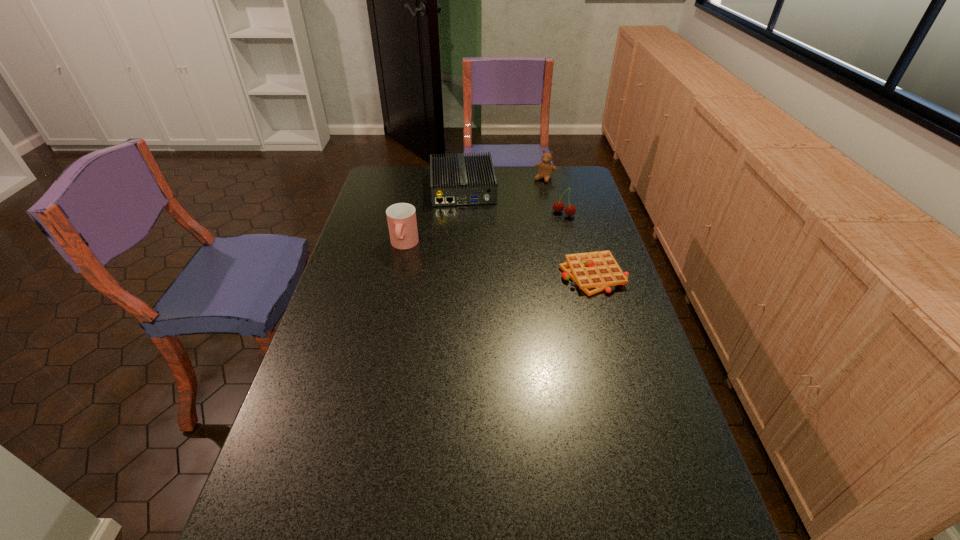
You are a GUI agent. You are given a task and a screenshot of the screen. Output one action in this format:
    pyautogui.click(x=<x>, y=<y>)
    Task: Click on the waffle that is at the right edge
    
    Given the screenshot: What is the action you would take?
    pyautogui.click(x=593, y=272)

I want to click on teddy bear at the right edge, so pyautogui.click(x=546, y=168).

Locate an element on the screen. The height and width of the screenshot is (540, 960). cherry that is at the right edge is located at coordinates (570, 210).

I want to click on object that is at the far right corner, so click(x=546, y=168).

The height and width of the screenshot is (540, 960). What are the coordinates of `free location at the far edge of the desktop` in the screenshot? It's located at (509, 174).

Locate an element on the screen. Image resolution: width=960 pixels, height=540 pixels. vacant region at the left edge of the desktop is located at coordinates [x=350, y=281].

Locate an element on the screen. vacant space at the right edge of the desktop is located at coordinates (564, 211).

Image resolution: width=960 pixels, height=540 pixels. In order to click on vacant space at the near right corner in this screenshot , I will do `click(691, 510)`.

You are a GUI agent. You are given a task and a screenshot of the screen. Output one action in this format:
    pyautogui.click(x=<x>, y=<y>)
    Task: Click on the free space between the cup and the teddy bear
    Image resolution: width=960 pixels, height=540 pixels.
    Given the screenshot: What is the action you would take?
    pyautogui.click(x=474, y=212)

The image size is (960, 540). I want to click on vacant region between the router and the cherry, so 513,202.